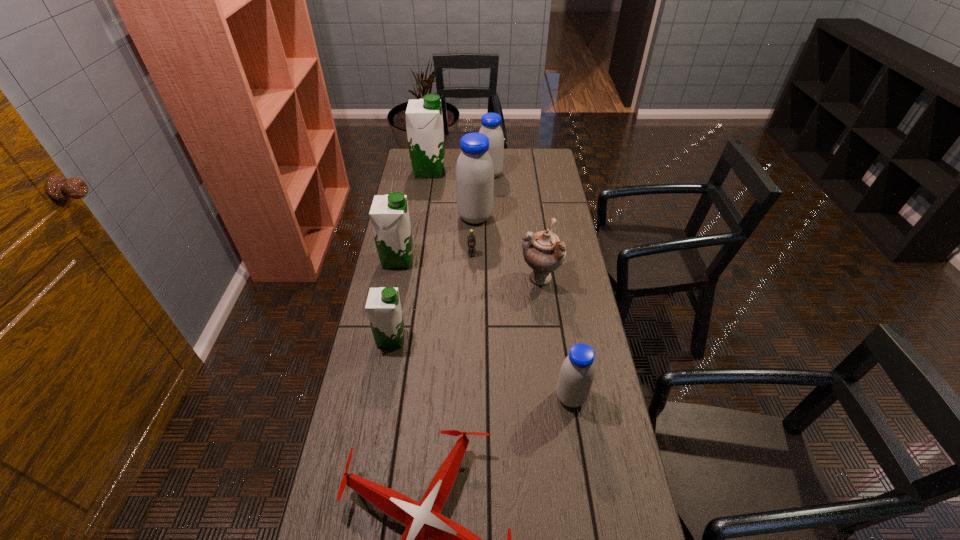
Locate an element on the screen. The image size is (960, 540). the farthest green soya milk is located at coordinates (424, 121).

Identify the location of the seventh nearest object. (474, 173).

At what (x,y) coordinates should I click in order to perform the action: click on the biggest blue soya milk. Please return your answer as a coordinate pair (x, y). This screenshot has height=540, width=960. Looking at the image, I should click on [x=474, y=173].

The image size is (960, 540). What are the coordinates of `the farthest blue soya milk` in the screenshot? It's located at (491, 122).

Find the location of a particular element. the fourth farthest soya milk is located at coordinates (389, 214).

This screenshot has height=540, width=960. I want to click on the second nearest green soya milk, so click(389, 214).

Identify the location of urn. (543, 252).

This screenshot has width=960, height=540. Find the location of `the nearest green soya milk`. the nearest green soya milk is located at coordinates click(383, 307).

At what (x,y) coordinates should I click in order to perform the action: click on the third nearest object. Please return your answer as a coordinate pair (x, y). This screenshot has height=540, width=960. Looking at the image, I should click on (383, 307).

Find the location of a particular element. the nearest blue soya milk is located at coordinates (577, 372).